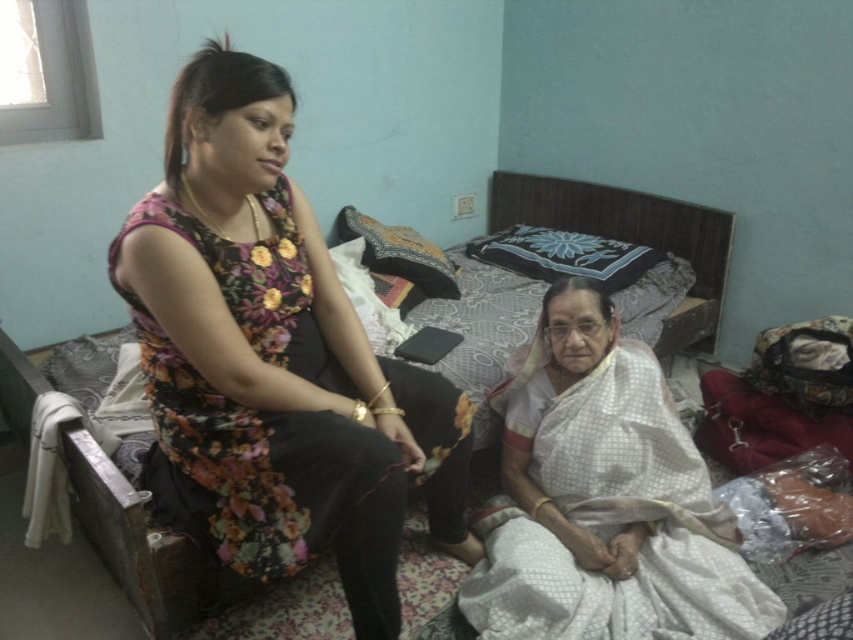
You are a photographer setting up a shoot in this room. You want to ensure that the white silk saree at lower right and the patterned fabric bed at center are both visible in the frame. Based on their positions, which object should you focus on first to capture both in the shot?

The white silk saree at lower right is in front of the patterned fabric bed at center, so you should focus on the patterned fabric bed at center first to ensure both are visible in the frame.

Based on the photo, you are standing at the entrance of the room and want to place a small vase between the white silk saree at lower right and the patterned fabric bed at center. Based on their positions, which object should the vase be closer to?

The white silk saree at lower right is to the left of the patterned fabric bed at center, so the vase should be placed closer to the white silk saree at lower right since it is positioned to the left side of the bed.